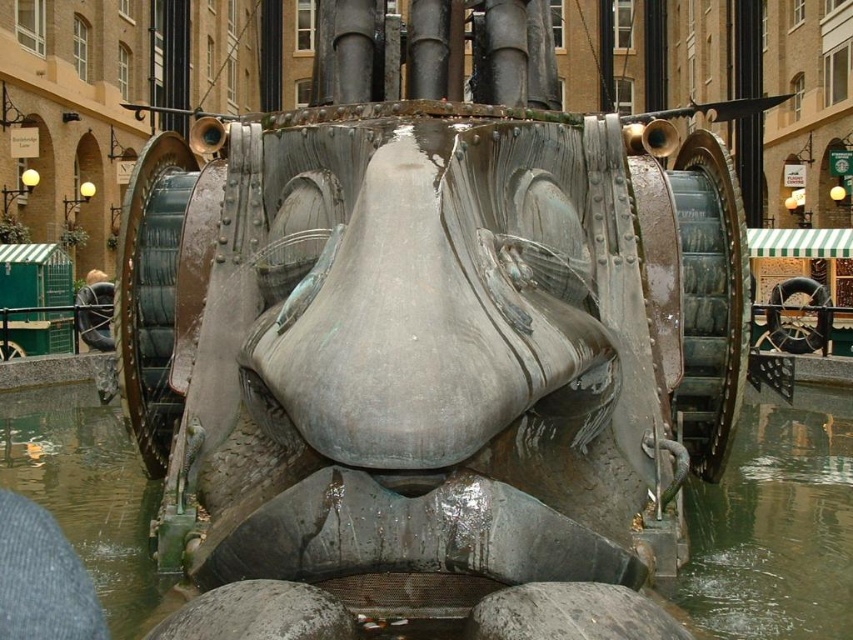
Question: Does metallic gray water at center appear on the left side of clear water at lower center?

Choices:
 (A) yes
 (B) no

Answer: (A)

Question: Which point is farther from the camera taking this photo?

Choices:
 (A) click(x=817, y=580)
 (B) click(x=811, y=637)

Answer: (A)

Question: Can you confirm if metallic gray water at center is positioned to the right of clear water at lower center?

Choices:
 (A) yes
 (B) no

Answer: (B)

Question: Is metallic gray water at center smaller than clear water at lower center?

Choices:
 (A) no
 (B) yes

Answer: (A)

Question: Which object appears farthest from the camera in this image?

Choices:
 (A) clear water at lower center
 (B) metallic gray water at center

Answer: (A)